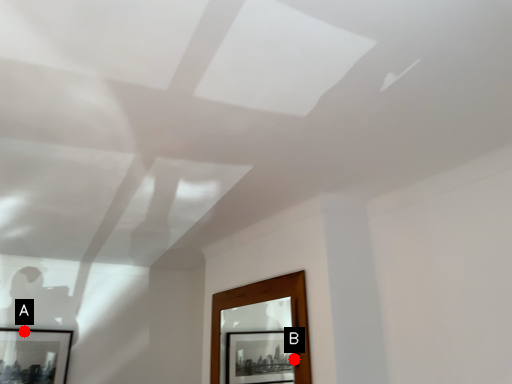
Question: Two points are circled on the image, labeled by A and B beside each circle. Which point is further to the camera?

Choices:
 (A) A is further
 (B) B is further

Answer: (A)